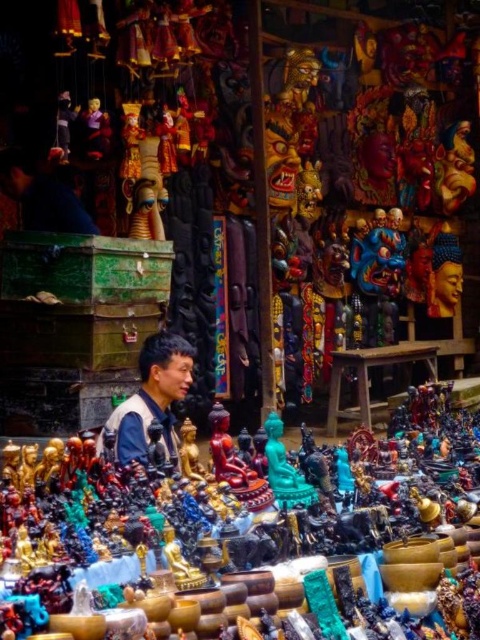
Question: Is shiny gold statue at center wider than matte black statue at center?

Choices:
 (A) no
 (B) yes

Answer: (B)

Question: Can you confirm if shiny gold statue at center is positioned above matte black statue at center?

Choices:
 (A) no
 (B) yes

Answer: (A)

Question: Which of the following is the closest to the observer?

Choices:
 (A) (122, 420)
 (B) (0, 536)

Answer: (B)

Question: Can you confirm if shiny gold statue at center is smaller than matte black statue at center?

Choices:
 (A) yes
 (B) no

Answer: (B)